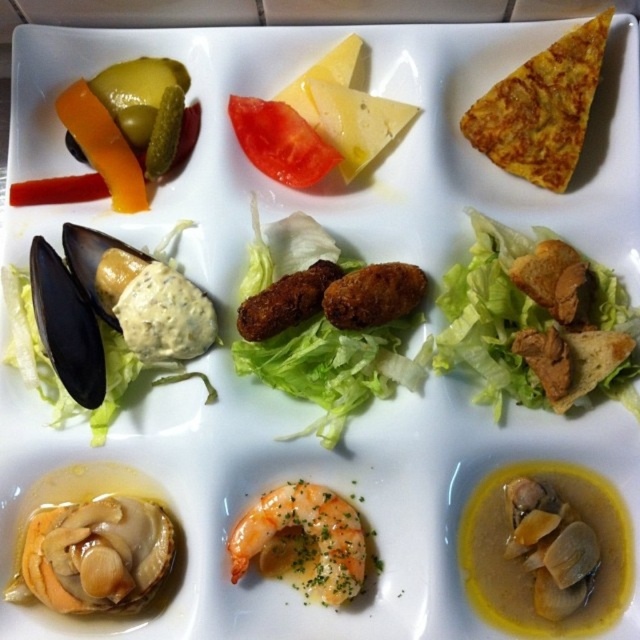
Based on the photo, you are a food critic evaluating portion sizes for a review. Given the green leafy lettuce at center and the golden crispy croquettes at center on the platter, which one has a bigger portion size?

The green leafy lettuce at center has a larger portion size than the golden crispy croquettes at center because it is described as being larger in size.

You are a food critic evaluating the height of the appetizers on the platter. Which object is taller between the golden crispy croquettes at center and the shiny orange shellfish at bottom left?

The golden crispy croquettes at center is much taller than the shiny orange shellfish at bottom left.

You are a food critic analyzing the arrangement of the appetizer platter. Which of the two items, the green leafy lettuce at center or the shiny orange shellfish at bottom left, is closer to you based on their positions on the platter?

The green leafy lettuce at center is closer to you than the shiny orange shellfish at bottom left because it is positioned further to the viewer in the scene.